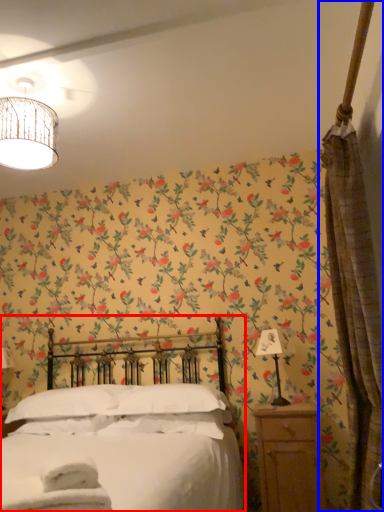
Question: Which object appears farthest to the camera in this image, bed (highlighted by a red box) or curtain (highlighted by a blue box)?

Choices:
 (A) bed
 (B) curtain

Answer: (B)